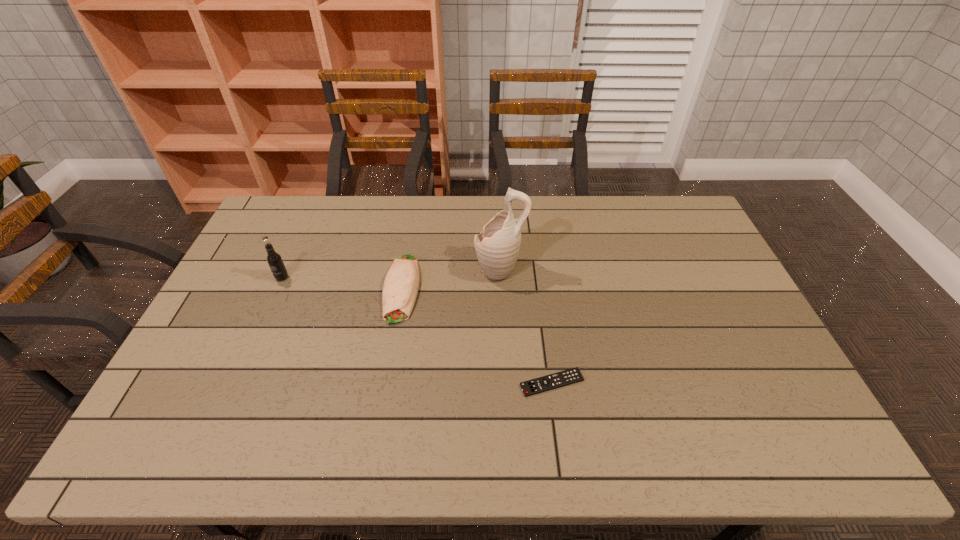
Identify the location of vacant area that lies between the burrito and the shortest object. (477, 335).

Image resolution: width=960 pixels, height=540 pixels. What are the coordinates of `free spot between the second tallest object and the third tallest object` in the screenshot? It's located at (342, 283).

Where is `free space that is in between the root beer and the remote control`? This screenshot has height=540, width=960. free space that is in between the root beer and the remote control is located at coordinates (417, 330).

Locate which object is the closest to the tallest object. Please provide its 2D coordinates. Your answer should be formatted as a tuple, i.e. [(x, y)], where the tuple contains the x and y coordinates of a point satisfying the conditions above.

[(401, 284)]

At what (x,y) coordinates should I click in order to perform the action: click on object that is the second nearest to the third object from right to left. Please return your answer as a coordinate pair (x, y). The width and height of the screenshot is (960, 540). Looking at the image, I should click on (275, 262).

Image resolution: width=960 pixels, height=540 pixels. What are the coordinates of `vacant space that satisfies the following two spatial constraints: 1. on the label of the root beer; 2. on the left side of the remote control` in the screenshot? It's located at (235, 382).

What are the coordinates of `blank area in the image that satisfies the following two spatial constraints: 1. at the spout of the pitcher; 2. on the right side of the remote control` in the screenshot? It's located at (505, 382).

Find the location of a particular element. vacant space that satisfies the following two spatial constraints: 1. at the bitten end of the third object from right to left; 2. on the right side of the nearest object is located at coordinates (385, 382).

At what (x,y) coordinates should I click in order to perform the action: click on vacant space that satisfies the following two spatial constraints: 1. at the bitten end of the second shortest object; 2. on the right side of the nearest object. Please return your answer as a coordinate pair (x, y). This screenshot has width=960, height=540. Looking at the image, I should click on (385, 382).

The image size is (960, 540). Find the location of `blank space that satisfies the following two spatial constraints: 1. at the bitten end of the second object from left to right; 2. on the left side of the nearest object`. blank space that satisfies the following two spatial constraints: 1. at the bitten end of the second object from left to right; 2. on the left side of the nearest object is located at coordinates (385, 382).